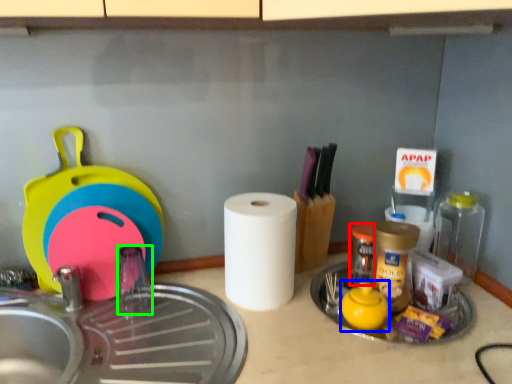
Question: Considering the real-world distances, which object is farthest from bottle (highlighted by a red box)? tea pot (highlighted by a blue box) or faucet (highlighted by a green box)?

Choices:
 (A) tea pot
 (B) faucet

Answer: (B)